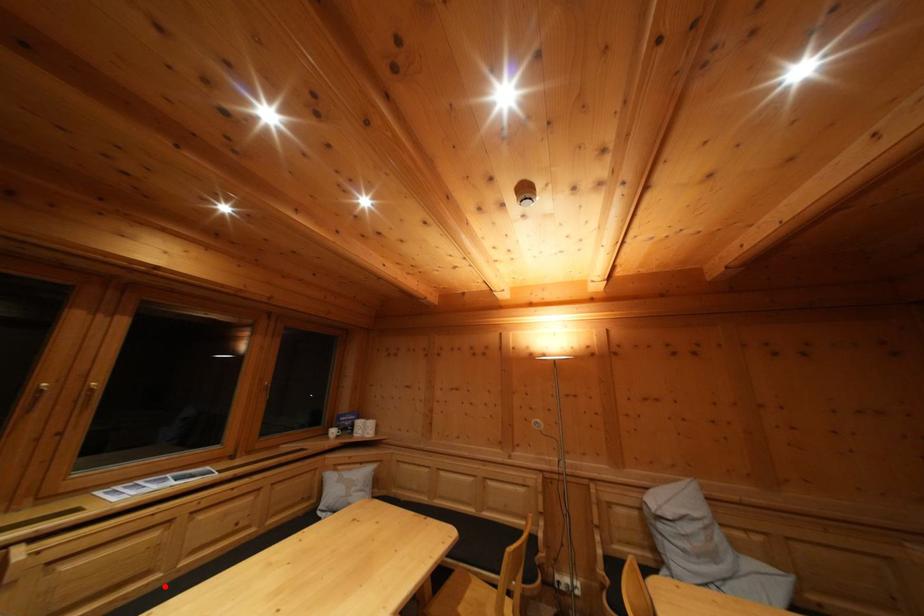
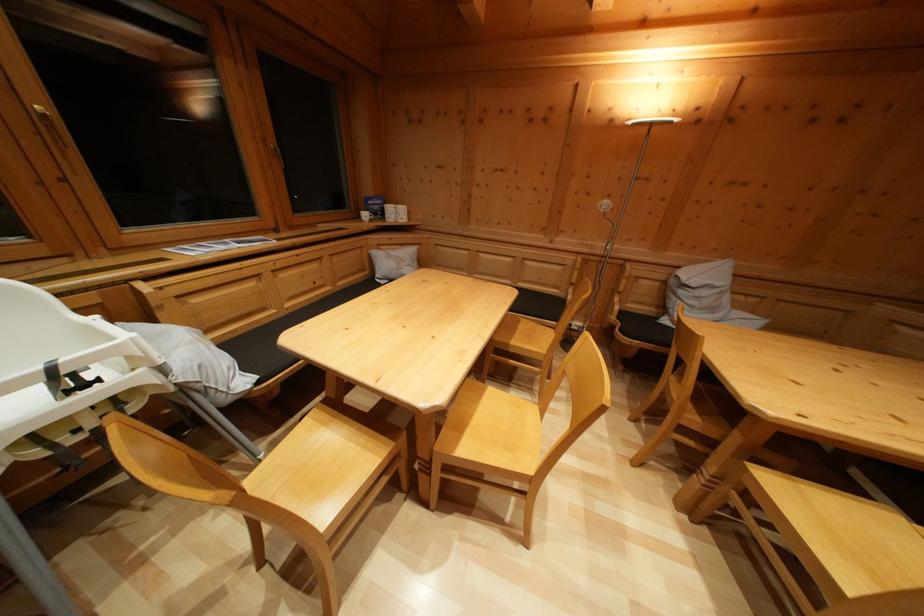
In the second image, find the point that corresponds to the highlighted location in the first image.

(282, 321)